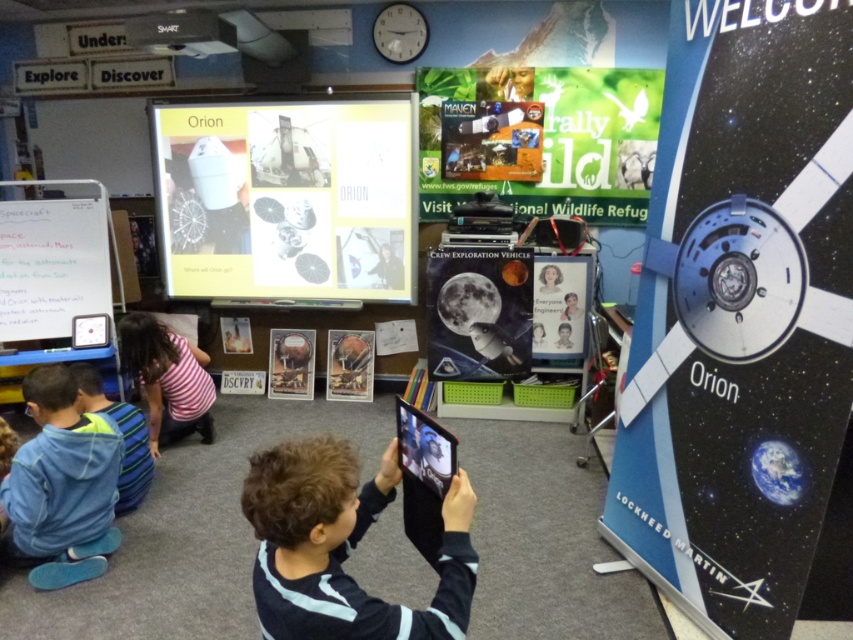
Question: Which point is closer to the camera?

Choices:
 (A) metallic blue and white orion spacecraft at right
 (B) white paper at upper center
 (C) striped fabric at lower left
 (D) whiteboard at left

Answer: (A)

Question: Does blue fleece jacket at lower left come behind matte black poster at center?

Choices:
 (A) yes
 (B) no

Answer: (B)

Question: Based on their relative distances, which object is farther from the striped fabric at lower left?

Choices:
 (A) metallic silver poster at center
 (B) green matte poster at upper center
 (C) blue denim jacket at lower left

Answer: (B)

Question: Is blue fleece jacket at lower left thinner than whiteboard at left?

Choices:
 (A) yes
 (B) no

Answer: (A)

Question: Does black matte tablet at center have a greater width compared to matte black poster at center?

Choices:
 (A) no
 (B) yes

Answer: (A)

Question: Which point is closer to the camera taking this photo?

Choices:
 (A) (369, 372)
 (B) (3, 250)

Answer: (B)